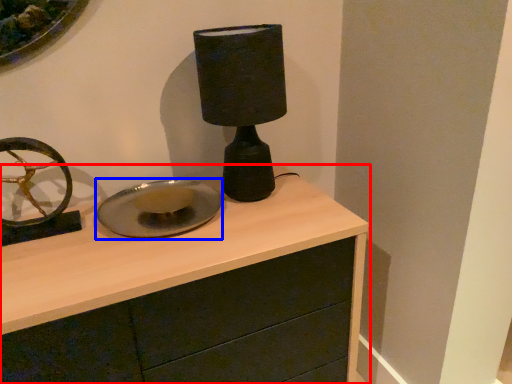
Question: Which object is further to the camera taking this photo, chest of drawers (highlighted by a red box) or plate (highlighted by a blue box)?

Choices:
 (A) chest of drawers
 (B) plate

Answer: (B)